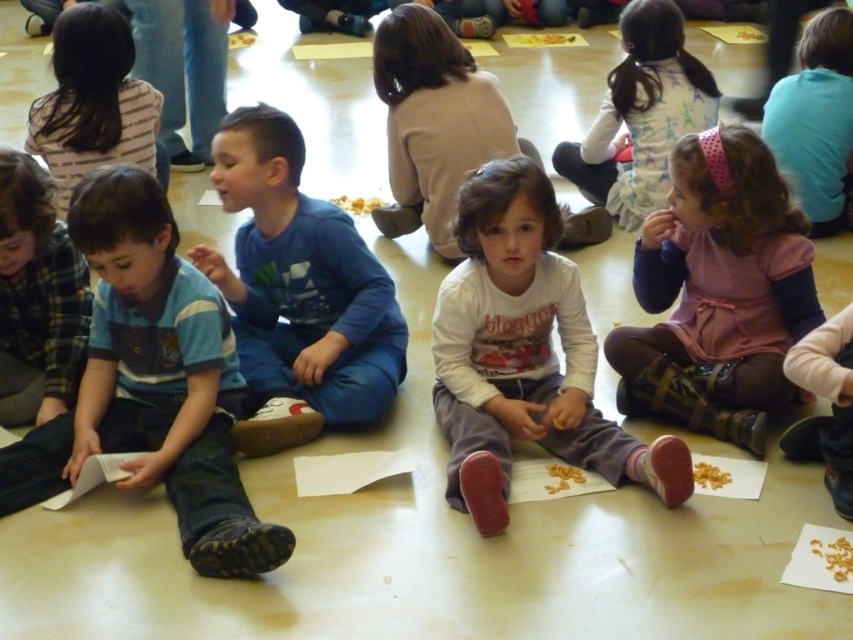
Can you confirm if white cotton dress at upper center is positioned to the left of pink fabric dress at upper right?

Indeed, white cotton dress at upper center is positioned on the left side of pink fabric dress at upper right.

Is white cotton dress at upper center bigger than pink fabric dress at upper right?

Correct, white cotton dress at upper center is larger in size than pink fabric dress at upper right.

Find the location of a particular element. white cotton dress at upper center is located at coordinates (641, 115).

Is blue denim jeans at left behind white cotton shirt at center?

That is False.

Which is above, blue denim jeans at left or white cotton shirt at center?

Positioned higher is white cotton shirt at center.

The width and height of the screenshot is (853, 640). What do you see at coordinates (151, 381) in the screenshot?
I see `blue denim jeans at left` at bounding box center [151, 381].

At what (x,y) coordinates should I click in order to perform the action: click on blue denim jeans at left. Please return your answer as a coordinate pair (x, y). Looking at the image, I should click on (151, 381).

Between white cotton shirt at center and white cotton dress at upper center, which one has more height?

Standing taller between the two is white cotton shirt at center.

Between point (596, 444) and point (634, 45), which one is positioned in front?

Point (596, 444) is in front.

At what (x,y) coordinates should I click in order to perform the action: click on white cotton shirt at center. Please return your answer as a coordinate pair (x, y). This screenshot has height=640, width=853. Looking at the image, I should click on (524, 353).